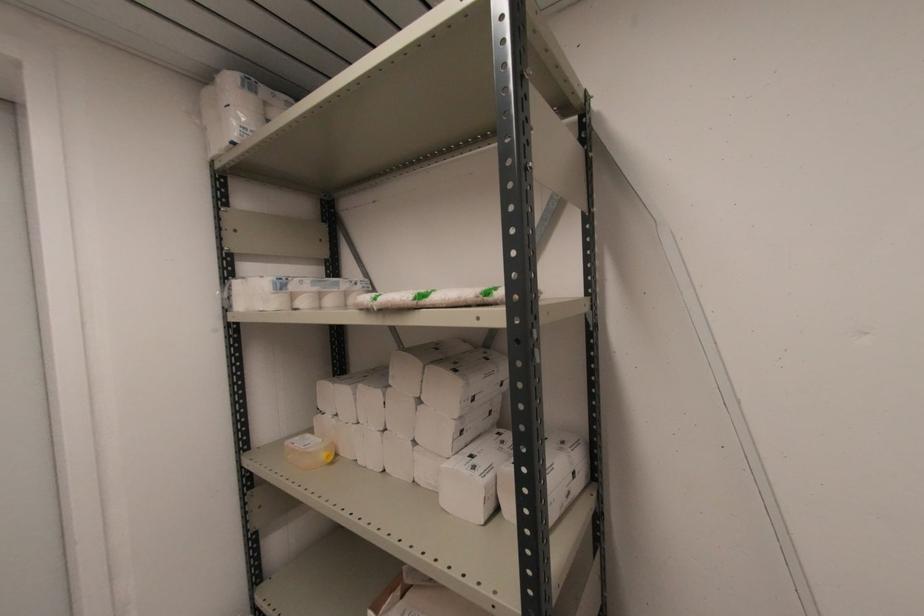
Find where to lift the package of toilet paper. Please return your answer as a coordinate pair (x, y).

(233, 106)